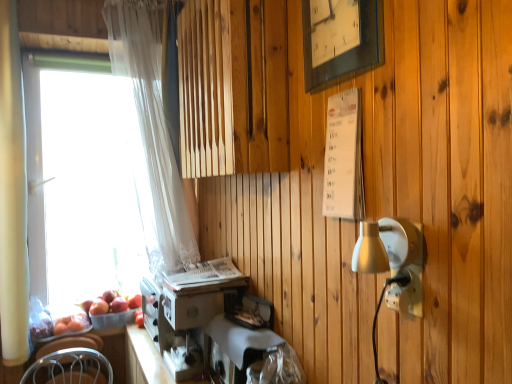
Locate an element on the screen. The height and width of the screenshot is (384, 512). wooden frame clock at upper center is located at coordinates pos(340,40).

Identify the location of white fabric-covered sewing machine at lower center. This screenshot has width=512, height=384. (240, 339).

This screenshot has height=384, width=512. Describe the element at coordinates (113, 319) in the screenshot. I see `translucent plastic basket at lower left` at that location.

Find the location of a particular element. The image size is (512, 384). wooden frame clock at upper center is located at coordinates (340, 40).

Which is in front, point (118, 313) or point (89, 311)?

Positioned in front is point (89, 311).

Is translucent plastic basket at lower left at the right side of red matte apple at lower left, the first apple from the left?

Indeed, translucent plastic basket at lower left is positioned on the right side of red matte apple at lower left, the first apple from the left.

From the image's perspective, which apple is the 1st one above the translucent plastic basket at lower left? Please provide its 2D coordinates.

[(99, 307)]

Measure the distance between translucent plastic basket at lower left and red matte apple at lower left, the 2th apple positioned from the right.

translucent plastic basket at lower left is 2.36 inches away from red matte apple at lower left, the 2th apple positioned from the right.

From the image's perspective, between red matte apple at lower left, the 2th apple from the left, and white sheer curtain at left, the 1th curtain viewed from the back, which one is located above?

white sheer curtain at left, the 1th curtain viewed from the back, is shown above in the image.

Considering the positions of point (118, 303) and point (113, 31), is point (118, 303) closer or farther from the camera than point (113, 31)?

Point (118, 303) is farther from the camera than point (113, 31).

Considering the relative sizes of red matte apple at lower left, the 2th apple from the left, and white sheer curtain at left, the 1th curtain viewed from the back, in the image provided, is red matte apple at lower left, the 2th apple from the left, taller than white sheer curtain at left, the 1th curtain viewed from the back,?

Incorrect, the height of red matte apple at lower left, the 2th apple from the left, is not larger of that of white sheer curtain at left, the 1th curtain viewed from the back.

Where is `the 2nd apple behind when counting from the white sheer curtain at left, the second curtain positioned from the left`? the 2nd apple behind when counting from the white sheer curtain at left, the second curtain positioned from the left is located at coordinates (118, 305).

Is the depth of metallic silver coffee machine at lower center less than that of white sheer curtain at left, the first curtain positioned from the right?

That is True.

Could you measure the distance between metallic silver coffee machine at lower center and white sheer curtain at left, the second curtain when ordered from front to back?

metallic silver coffee machine at lower center is 20.65 inches from white sheer curtain at left, the second curtain when ordered from front to back.

Which is behind, point (170, 324) or point (134, 40)?

Positioned behind is point (134, 40).

From a real-world perspective, is metallic silver coffee machine at lower center under white sheer curtain at left, the second curtain when ordered from front to back?

Yes.

Considering the relative sizes of metallic silver coffee machine at lower center and white fabric-covered sewing machine at lower center in the image provided, is metallic silver coffee machine at lower center thinner than white fabric-covered sewing machine at lower center?

In fact, metallic silver coffee machine at lower center might be wider than white fabric-covered sewing machine at lower center.

Where is `appliance in front of the metallic silver coffee machine at lower center`? This screenshot has width=512, height=384. appliance in front of the metallic silver coffee machine at lower center is located at coordinates pos(240,339).

Considering the sizes of objects metallic silver coffee machine at lower center and white fabric-covered sewing machine at lower center in the image provided, who is bigger, metallic silver coffee machine at lower center or white fabric-covered sewing machine at lower center?

With larger size is metallic silver coffee machine at lower center.

Consider the image. Is metallic silver coffee machine at lower center situated inside white fabric-covered sewing machine at lower center or outside?

metallic silver coffee machine at lower center is not enclosed by white fabric-covered sewing machine at lower center.

Does point (264, 334) lie in front of point (116, 313)?

Yes, it is.

What's the angular difference between white fabric-covered sewing machine at lower center and translucent plastic basket at lower left's facing directions?

They differ by 76.5 degrees in their facing directions.

Would you consider white fabric-covered sewing machine at lower center to be distant from translucent plastic basket at lower left?

No.

Which object is closer to the camera, white fabric-covered sewing machine at lower center or translucent plastic basket at lower left?

white fabric-covered sewing machine at lower center is closer to the camera.

Could you measure the distance between white sheer curtain at left, the 2th curtain when ordered from back to front, and red matte apple at lower left, the 1th apple positioned from the right?

white sheer curtain at left, the 2th curtain when ordered from back to front, is 28.61 inches from red matte apple at lower left, the 1th apple positioned from the right.

Do you think white sheer curtain at left, which appears as the 1th curtain when viewed from the left, is within red matte apple at lower left, the 1th apple positioned from the right, or outside of it?

The correct answer is: outside.

Is point (16, 34) behind point (124, 310)?

No.

From a real-world perspective, is white sheer curtain at left, the 2th curtain when ordered from back to front, positioned under red matte apple at lower left, the 2th apple from the left, based on gravity?

No, from a real-world perspective, white sheer curtain at left, the 2th curtain when ordered from back to front, is not below red matte apple at lower left, the 2th apple from the left.

This screenshot has width=512, height=384. I want to click on appliance that is on the right side of white sheer curtain at left, which ranks as the second curtain in right-to-left order, so (x=240, y=339).

In the scene shown: From the image's perspective, is white sheer curtain at left, the 2th curtain when ordered from back to front, below white fabric-covered sewing machine at lower center?

Actually, white sheer curtain at left, the 2th curtain when ordered from back to front, appears above white fabric-covered sewing machine at lower center in the image.

Could you measure the distance between white sheer curtain at left, the 2th curtain when ordered from back to front, and white fabric-covered sewing machine at lower center?

white sheer curtain at left, the 2th curtain when ordered from back to front, is 1.08 meters from white fabric-covered sewing machine at lower center.

From a real-world perspective, is white sheer curtain at left, positioned as the first curtain in front-to-back order, under white fabric-covered sewing machine at lower center?

No, from a real-world perspective, white sheer curtain at left, positioned as the first curtain in front-to-back order, is not beneath white fabric-covered sewing machine at lower center.

At what (x,y) coordinates should I click in order to perform the action: click on the 1st apple above the translucent plastic basket at lower left (from the image's perspective). Please return your answer as a coordinate pair (x, y). The height and width of the screenshot is (384, 512). Looking at the image, I should click on (99, 307).

The image size is (512, 384). In order to click on curtain on the right of red matte apple at lower left, the 2th apple from the left in this screenshot , I will do `click(152, 127)`.

Based on their spatial positions, is wooden frame clock at upper center or white fabric-covered sewing machine at lower center closer to white sheer curtain at left, the second curtain when ordered from front to back?

The object closer to white sheer curtain at left, the second curtain when ordered from front to back, is white fabric-covered sewing machine at lower center.

Based on their spatial positions, is white sheer curtain at left, the first curtain positioned from the right, or red matte apple at lower left, the 2th apple positioned from the right, closer to white fabric-covered sewing machine at lower center?

The object closer to white fabric-covered sewing machine at lower center is white sheer curtain at left, the first curtain positioned from the right.

When comparing their distances from white fabric-covered sewing machine at lower center, does transparent glass window at left or translucent plastic basket at lower left seem closer?

translucent plastic basket at lower left.

From the image, which object appears to be farther from white fabric-covered sewing machine at lower center, transparent glass window at left or red matte apple at lower left, the 2th apple positioned from the right?

transparent glass window at left lies further to white fabric-covered sewing machine at lower center than the other object.

Consider the image. Looking at the image, which one is located further to transparent glass window at left, metallic silver coffee machine at lower center or translucent plastic basket at lower left?

metallic silver coffee machine at lower center lies further to transparent glass window at left than the other object.

Considering their positions, is white sheer curtain at left, positioned as the first curtain in front-to-back order, positioned further to white sheer curtain at left, the second curtain when ordered from front to back, than metallic silver coffee machine at lower center?

white sheer curtain at left, positioned as the first curtain in front-to-back order, is positioned further to the anchor white sheer curtain at left, the second curtain when ordered from front to back.

From the picture: Based on their spatial positions, is white fabric-covered sewing machine at lower center or wooden frame clock at upper center further from translucent plastic basket at lower left?

The object further to translucent plastic basket at lower left is wooden frame clock at upper center.

From the picture: Looking at the image, which one is located closer to red matte apple at lower left, the 2th apple from the left, white sheer curtain at left, the 2th curtain when ordered from back to front, or white sheer curtain at left, the second curtain when ordered from front to back?

Based on the image, white sheer curtain at left, the 2th curtain when ordered from back to front, appears to be nearer to red matte apple at lower left, the 2th apple from the left.

Where is `window positioned between wooden frame clock at upper center and translucent plastic basket at lower left from near to far`? Image resolution: width=512 pixels, height=384 pixels. window positioned between wooden frame clock at upper center and translucent plastic basket at lower left from near to far is located at coordinates (81, 175).

At what (x,y) coordinates should I click in order to perform the action: click on curtain situated between white sheer curtain at left, the 2th curtain when ordered from back to front, and wooden frame clock at upper center from left to right. Please return your answer as a coordinate pair (x, y). The width and height of the screenshot is (512, 384). Looking at the image, I should click on (152, 127).

Image resolution: width=512 pixels, height=384 pixels. In order to click on window between white fabric-covered sewing machine at lower center and red matte apple at lower left, the 1th apple positioned from the right, in the front-back direction in this screenshot , I will do `click(81, 175)`.

Locate an element on the screen. Image resolution: width=512 pixels, height=384 pixels. coffee machine between white sheer curtain at left, the second curtain positioned from the left, and red matte apple at lower left, the 1th apple positioned from the right, from top to bottom is located at coordinates (188, 311).